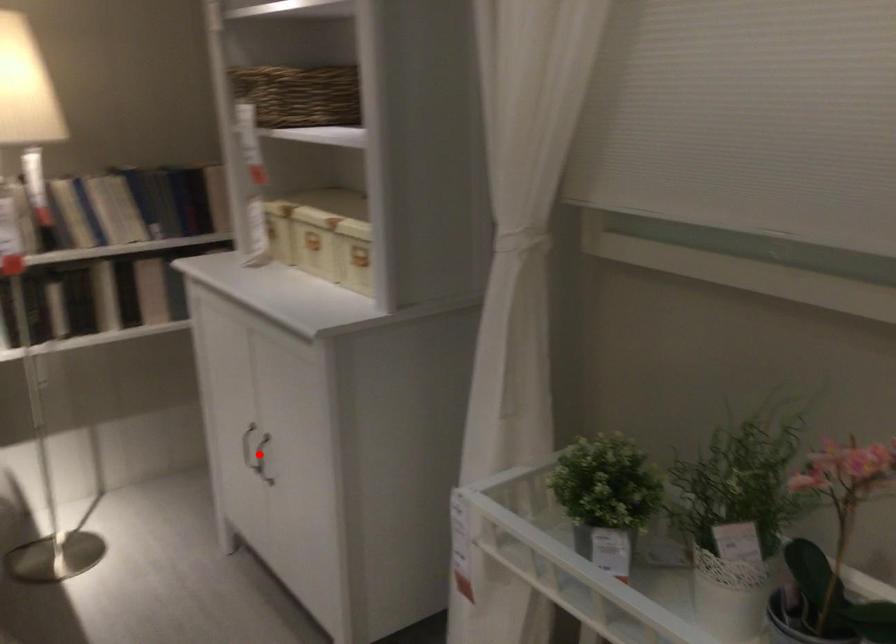
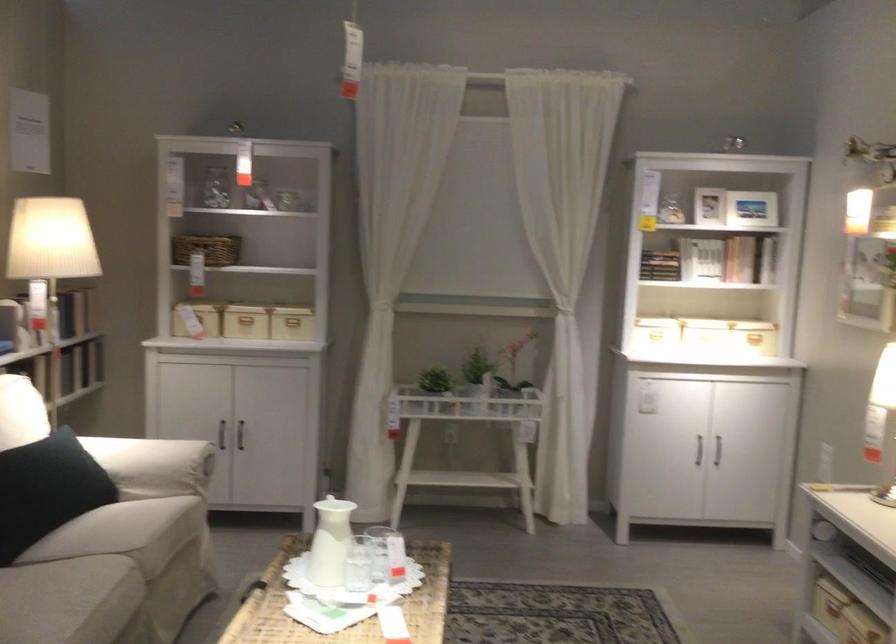
Question: I am providing you with two images of the same scene from different viewpoints. Image1 has a red point marked. In image2, the corresponding 3D location appears at what relative position? Reply with the corresponding letter.

Choices:
 (A) Closer
 (B) Farther

Answer: (B)